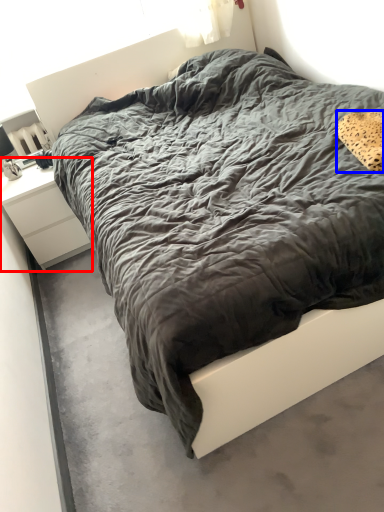
Question: Among these objects, which one is nearest to the camera, nightstand (highlighted by a red box) or pillow (highlighted by a blue box)?

Choices:
 (A) nightstand
 (B) pillow

Answer: (B)